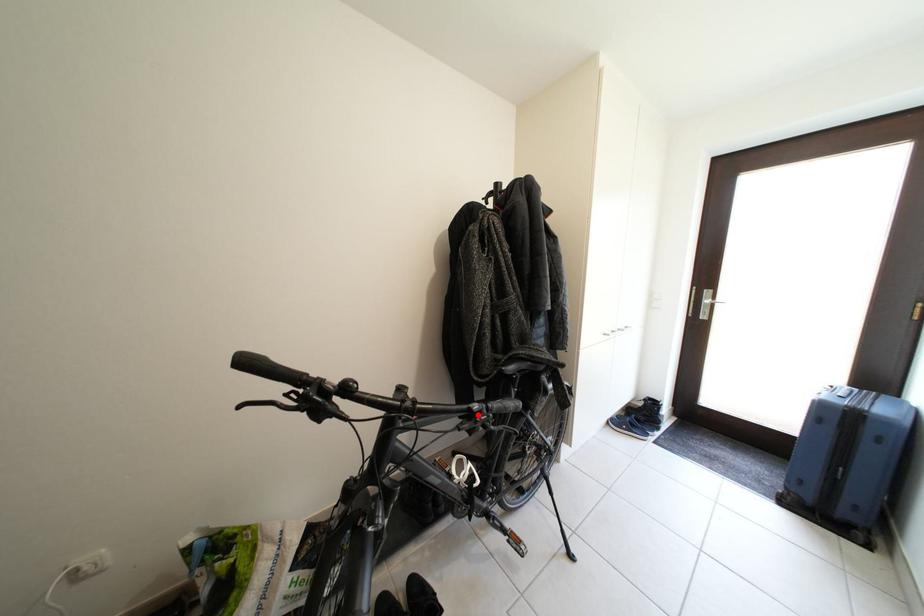
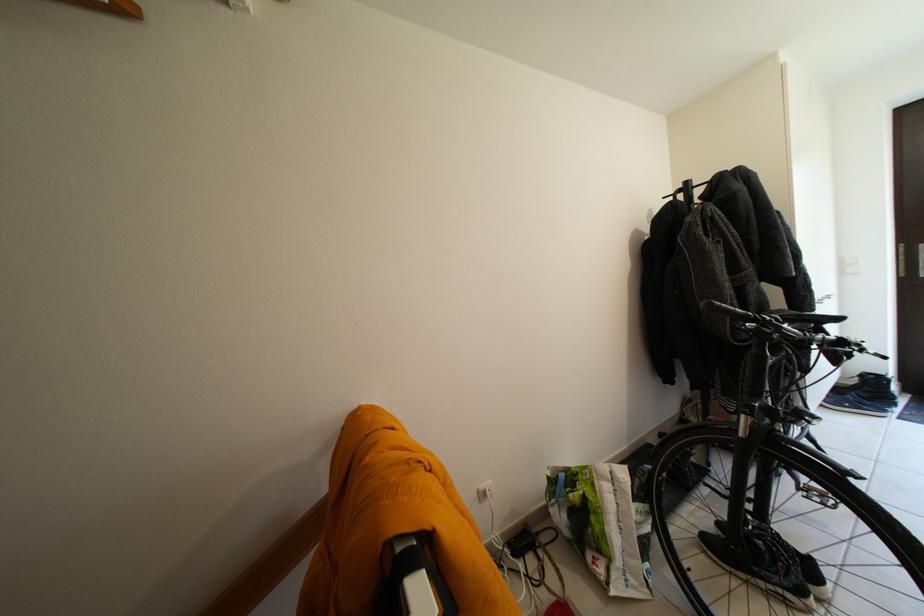
In the second image, find the point that corresponds to the highlighted location in the first image.

(849, 344)